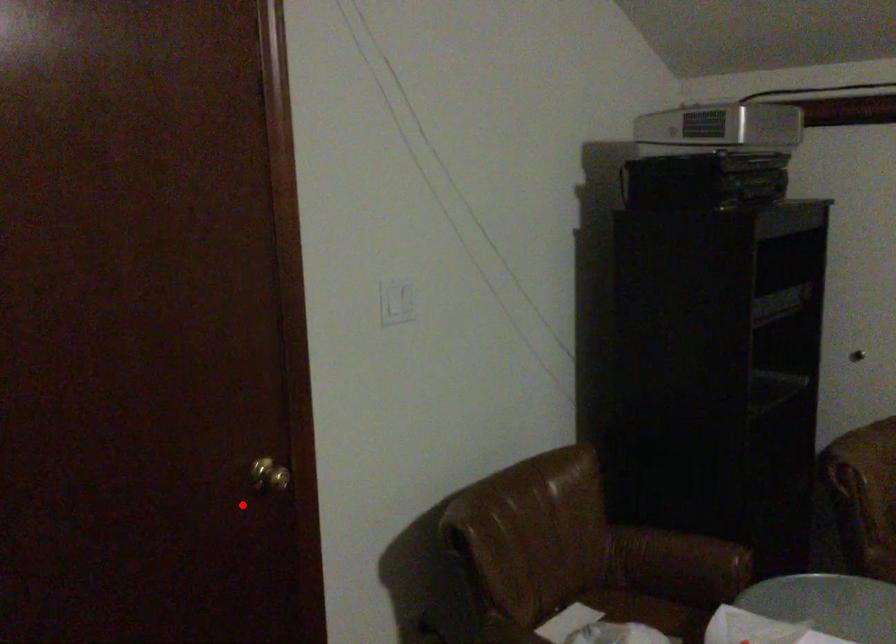
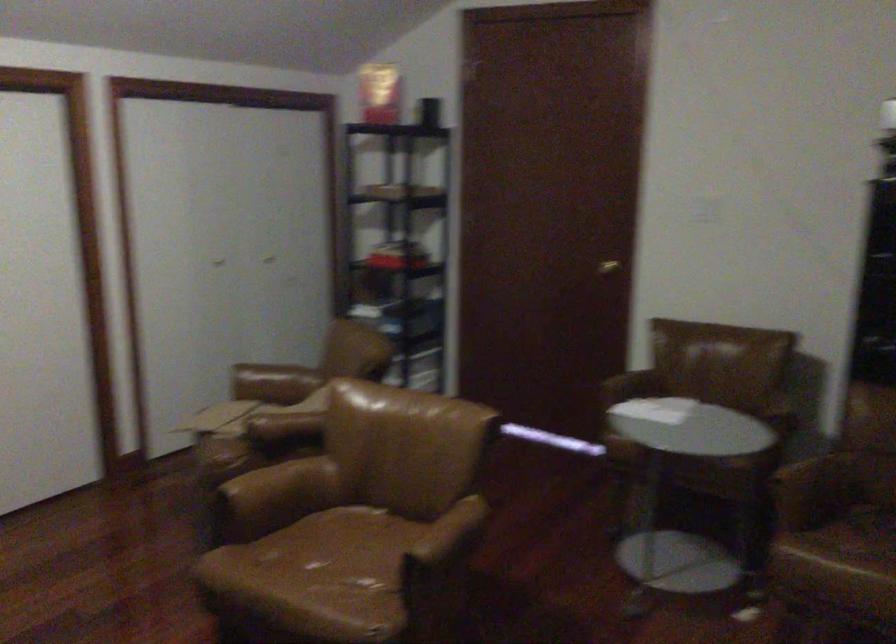
Question: A red point is marked in image1. In image2, is the corresponding 3D point closer to the camera or farther? Reply with the corresponding letter.

Choices:
 (A) The corresponding 3D point is closer.
 (B) The corresponding 3D point is farther.

Answer: (B)